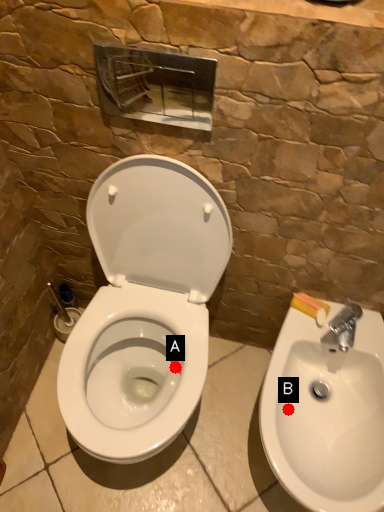
Question: Two points are circled on the image, labeled by A and B beside each circle. Which point is closer to the camera?

Choices:
 (A) A is closer
 (B) B is closer

Answer: (B)